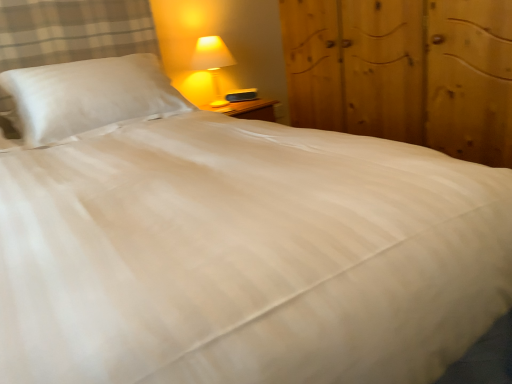
Question: Is the depth of white satin pillow at upper left greater than that of wooden dresser at right?

Choices:
 (A) no
 (B) yes

Answer: (B)

Question: From the image's perspective, is white satin pillow at upper left located above wooden dresser at right?

Choices:
 (A) yes
 (B) no

Answer: (B)

Question: Is white satin pillow at upper left wider than wooden dresser at right?

Choices:
 (A) no
 (B) yes

Answer: (A)

Question: Is wooden dresser at right at the back of white satin pillow at upper left?

Choices:
 (A) yes
 (B) no

Answer: (B)

Question: Can you confirm if white satin pillow at upper left is smaller than wooden dresser at right?

Choices:
 (A) no
 (B) yes

Answer: (B)

Question: From a real-world perspective, is white satin pillow at upper left above or below wooden dresser at right?

Choices:
 (A) above
 (B) below

Answer: (A)

Question: From the image's perspective, is white satin pillow at upper left above or below wooden dresser at right?

Choices:
 (A) above
 (B) below

Answer: (B)

Question: Is white satin pillow at upper left in front of or behind wooden dresser at right in the image?

Choices:
 (A) behind
 (B) front

Answer: (A)

Question: Would you say white satin pillow at upper left is inside or outside wooden dresser at right?

Choices:
 (A) outside
 (B) inside

Answer: (A)

Question: In terms of width, does white satin pillow at upper left look wider or thinner when compared to matte yellow plastic lamp at upper right?

Choices:
 (A) wide
 (B) thin

Answer: (A)

Question: Relative to matte yellow plastic lamp at upper right, is white satin pillow at upper left in front or behind?

Choices:
 (A) behind
 (B) front

Answer: (B)

Question: Is point [x=62, y=135] closer or farther from the camera than point [x=197, y=64]?

Choices:
 (A) closer
 (B) farther

Answer: (A)

Question: From the image's perspective, relative to matte yellow plastic lamp at upper right, is white satin pillow at upper left above or below?

Choices:
 (A) above
 (B) below

Answer: (B)

Question: Choose the correct answer: Is wooden dresser at right inside white satin pillow at upper left or outside it?

Choices:
 (A) outside
 (B) inside

Answer: (A)

Question: From a real-world perspective, is wooden dresser at right above or below white satin pillow at upper left?

Choices:
 (A) below
 (B) above

Answer: (A)